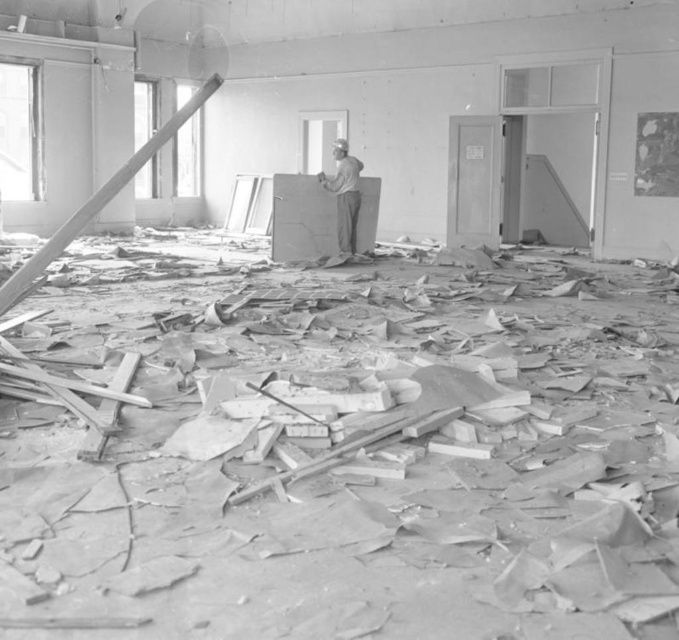
You are a construction worker who needs to move a heavy tool from one side of the room to the other. There are crumbly concrete debris at center and gray fabric cap at center in the way. Which obstacle should you move first to clear the path?

The crumbly concrete debris at center has a smaller size compared to gray fabric cap at center, so you should move the crumbly concrete debris at center first since it is easier to handle due to its smaller size.

You are a construction worker who needs to move from the crumbly concrete debris at center to the gray fabric cap at center. Can you walk directly between them without any obstacles?

The crumbly concrete debris at center and gray fabric cap at center are 7.71 meters apart, so you can walk directly between them without any obstacles.

You are a construction worker who needs to move a 6 feet long plank from one side of the room to the other. The crumbly concrete debris at center is blocking your path. Can you safely move the plank around the debris without shortening it?

The crumbly concrete debris at center is 6.42 feet apart. Since the plank is 6 feet long, you can safely move it around the debris as the distance between them allows enough space for the plank to pass without needing to be shortened.